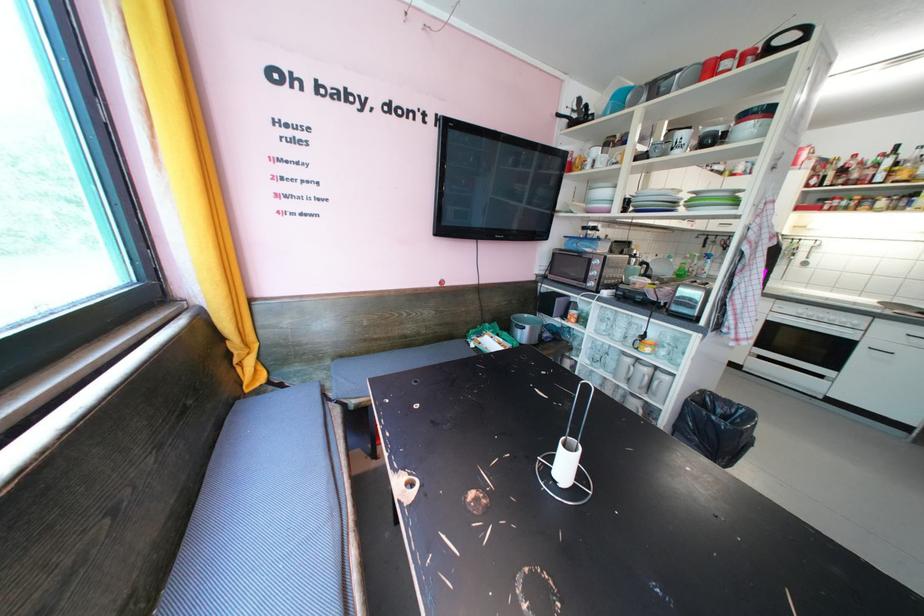
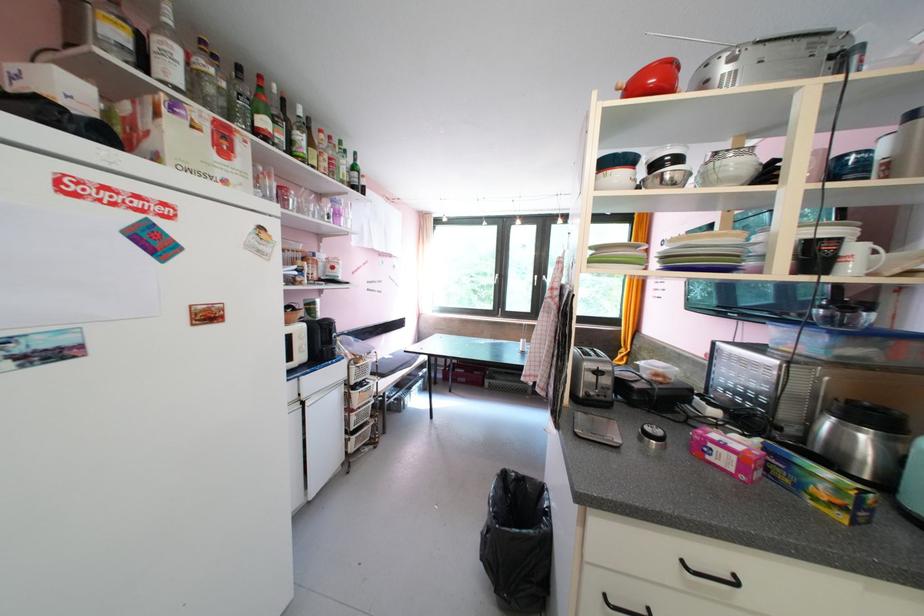
Question: I am providing you with two images of the same scene from different viewpoints. After the viewpoint changes to image2, which objects are now occluded?

Choices:
 (A) black cabinet handle
 (B) microwave oven handle
 (C) green cardboard box
 (D) brown folded blanket

Answer: (B)